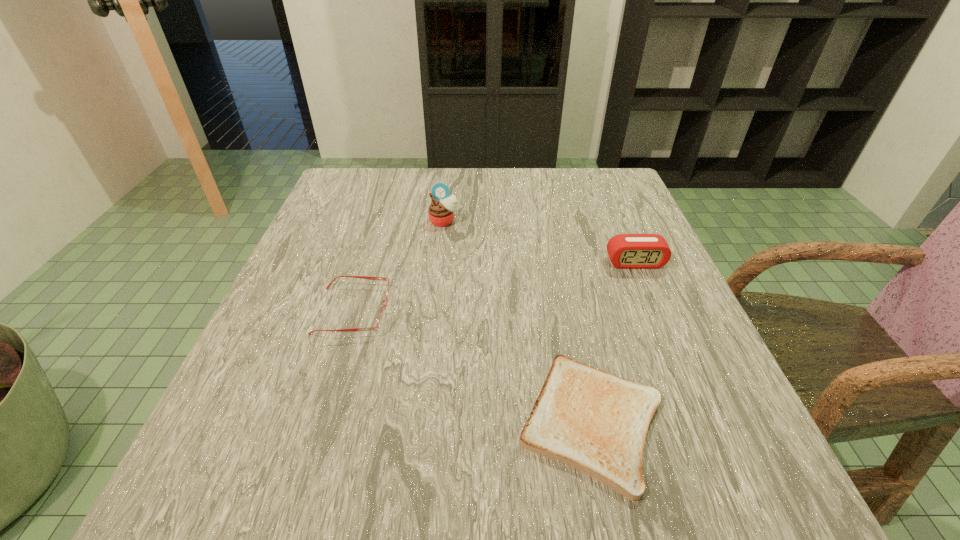
This screenshot has height=540, width=960. What are the coordinates of `free space in the image that satisfies the following two spatial constraints: 1. on the front-facing side of the second tallest object; 2. on the lenses of the spectacles` in the screenshot? It's located at (656, 310).

Locate an element on the screen. This screenshot has height=540, width=960. free space in the image that satisfies the following two spatial constraints: 1. on the lenses of the nearest object; 2. on the left side of the leftmost object is located at coordinates (320, 421).

Find the location of a particular element. This screenshot has height=540, width=960. vacant space that satisfies the following two spatial constraints: 1. on the lenses of the second nearest object; 2. on the back side of the toast is located at coordinates (320, 421).

You are a GUI agent. You are given a task and a screenshot of the screen. Output one action in this format:
    pyautogui.click(x=<x>, y=<y>)
    Task: Click on the vacant space that satisfies the following two spatial constraints: 1. on the front-facing side of the third nearest object; 2. on the lenses of the second nearest object
    
    Given the screenshot: What is the action you would take?
    pyautogui.click(x=656, y=310)

At what (x,y) coordinates should I click in order to perform the action: click on blank space that satisfies the following two spatial constraints: 1. on the front-facing side of the third nearest object; 2. on the lenses of the second shortest object. Please return your answer as a coordinate pair (x, y). Looking at the image, I should click on (656, 310).

Image resolution: width=960 pixels, height=540 pixels. What are the coordinates of `free space that satisfies the following two spatial constraints: 1. on the front-facing side of the third nearest object; 2. on the lenses of the second nearest object` in the screenshot? It's located at (656, 310).